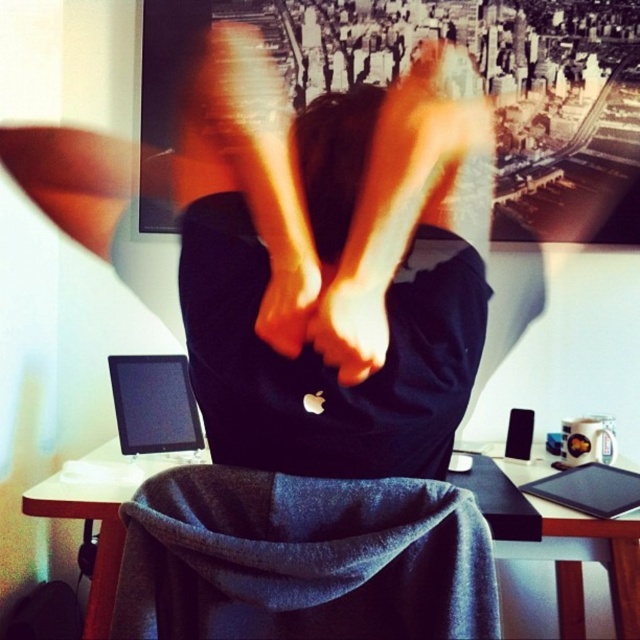
Looking at this image, you are a photographer trying to capture a clear photo of the person sitting at the desk. Since the person is moving their head rapidly, you decide to focus on the black matte hoodie at center and the matte black hand at center. Which object should you focus on to ensure it stays in frame longer?

The black matte hoodie at center is positioned on the left side of matte black hand at center, so focusing on the black matte hoodie at center would keep it in frame longer as it is less likely to move out of the frame compared to the hand which is moving.

You are a photographer trying to capture a clear image of the matte black hand at center. The camera you are using has a focus point at coordinates point (349, 321). Will the focus point align with the matte black hand at center?

The point (349, 321) indicates the matte black hand at center, so yes, the focus point will align with the matte black hand at center.

You are designing a virtual tour of the home office and need to place a new lamp. The lamp must be positioned to the left of the black matte hoodie at center. Where should you place the lamp?

The lamp should be placed to the left of the black matte hoodie at center, which is located at point 0.452 on the x and 0.550 on the y coordinates.